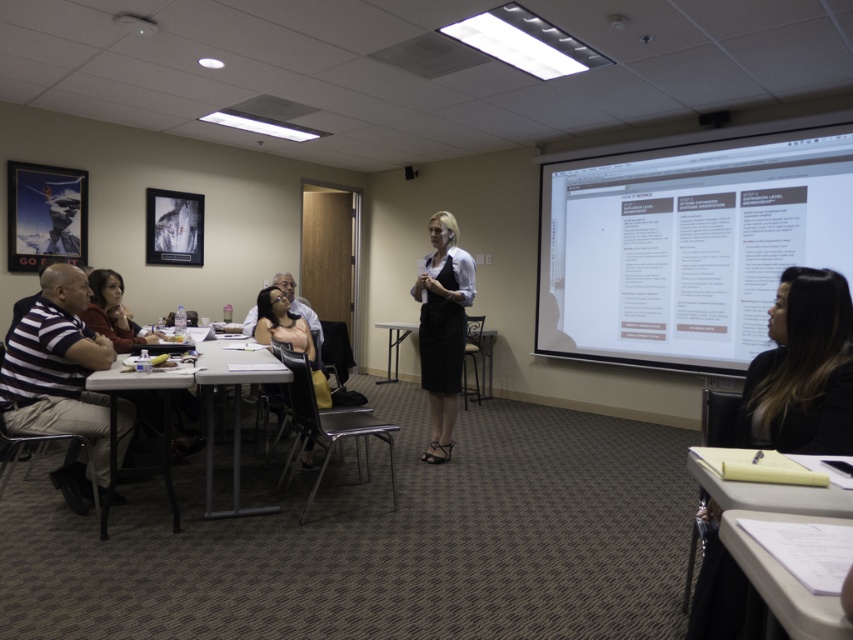
Does white matte projection screen at upper right come behind matte black dress at lower center?

Yes, white matte projection screen at upper right is further from the viewer.

Who is higher up, white matte projection screen at upper right or matte black dress at lower center?

white matte projection screen at upper right is higher up.

Which is behind, point (573, 349) or point (280, 340)?

The point (573, 349) is more distant.

You are a GUI agent. You are given a task and a screenshot of the screen. Output one action in this format:
    pyautogui.click(x=<x>, y=<y>)
    Task: Click on the white matte projection screen at upper right
    Image resolution: width=853 pixels, height=640 pixels.
    Given the screenshot: What is the action you would take?
    pyautogui.click(x=686, y=244)

Between point (634, 148) and point (421, 326), which one is positioned in front?

Point (421, 326) is more forward.

Find the location of a particular element. This screenshot has width=853, height=640. white matte projection screen at upper right is located at coordinates (686, 244).

Is striped fabric shirt at left to the right of matte black dress at lower center from the viewer's perspective?

In fact, striped fabric shirt at left is to the left of matte black dress at lower center.

Is striped fabric shirt at left in front of matte black dress at lower center?

Yes.

Between point (76, 461) and point (303, 337), which one is positioned in front?

Positioned in front is point (76, 461).

Locate an element on the screen. striped fabric shirt at left is located at coordinates (59, 380).